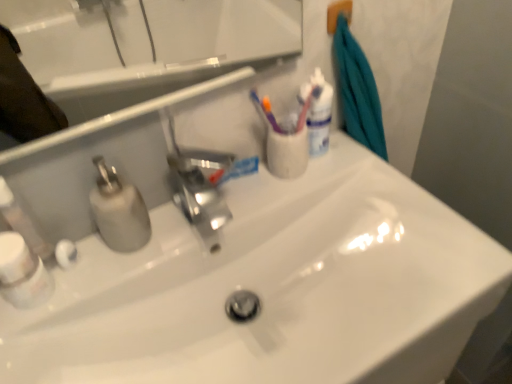
Where is `free space in front of white glossy mouthwash at upper right, positioned as the 2th mouthwash in bottom-to-top order`? The height and width of the screenshot is (384, 512). free space in front of white glossy mouthwash at upper right, positioned as the 2th mouthwash in bottom-to-top order is located at coordinates (x=337, y=182).